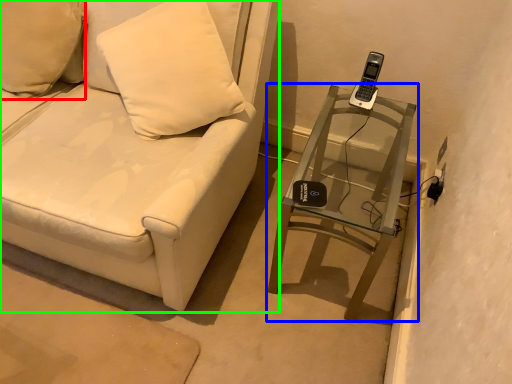
Question: Estimate the real-world distances between objects in this image. Which object is closer to pillow (highlighted by a red box), table (highlighted by a blue box) or furniture (highlighted by a green box)?

Choices:
 (A) table
 (B) furniture

Answer: (B)